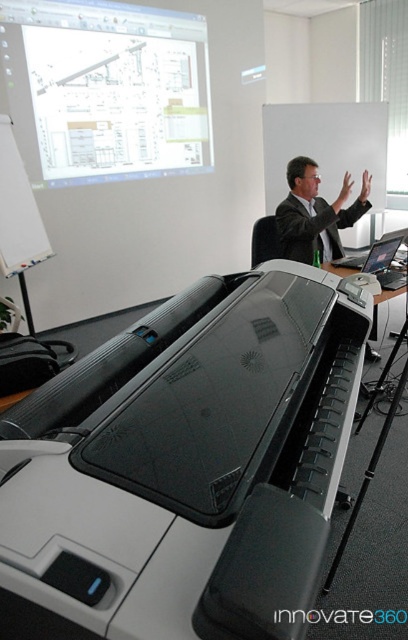
The height and width of the screenshot is (640, 408). What do you see at coordinates (115, 88) in the screenshot? I see `white glossy projection screen at upper left` at bounding box center [115, 88].

The height and width of the screenshot is (640, 408). What do you see at coordinates (115, 88) in the screenshot?
I see `white glossy projection screen at upper left` at bounding box center [115, 88].

The height and width of the screenshot is (640, 408). Identify the location of white glossy projection screen at upper left. (115, 88).

Can you confirm if white glossy projection screen at upper left is positioned above glossy plastic laptop at upper right?

Yes, white glossy projection screen at upper left is above glossy plastic laptop at upper right.

Is point (130, 88) positioned before point (379, 241)?

No, it is not.

Is point (130, 163) less distant than point (370, 253)?

No, it is not.

What are the coordinates of `white glossy projection screen at upper left` in the screenshot? It's located at (115, 88).

Does glossy plastic laptop at upper right have a lesser width compared to matte black laptop at center?

Correct, glossy plastic laptop at upper right's width is less than matte black laptop at center's.

Does glossy plastic laptop at upper right appear over matte black laptop at center?

Actually, glossy plastic laptop at upper right is below matte black laptop at center.

Does point (390, 273) lie behind point (392, 257)?

No, it is in front of (392, 257).

This screenshot has height=640, width=408. I want to click on glossy plastic laptop at upper right, so click(385, 262).